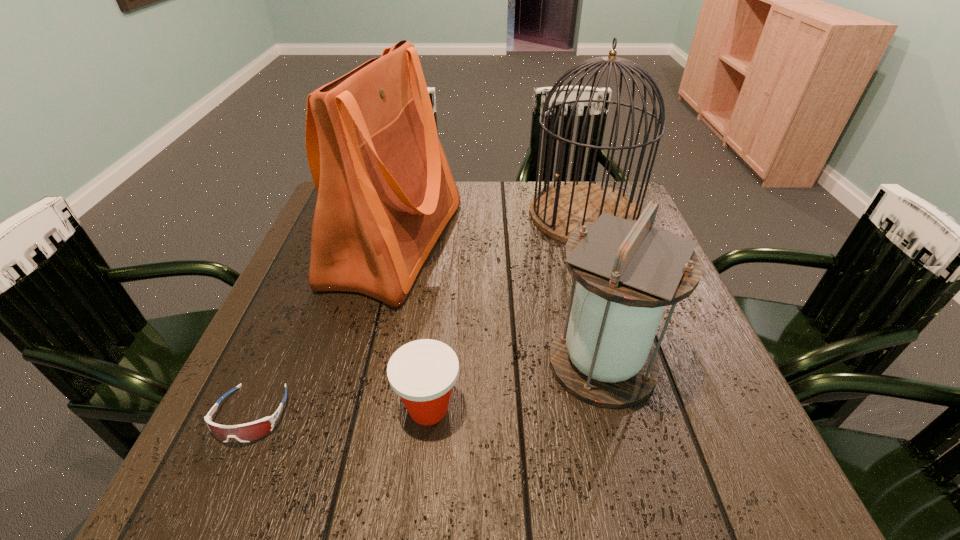
Where is `free space at the right edge of the desktop`? The height and width of the screenshot is (540, 960). free space at the right edge of the desktop is located at coordinates (680, 430).

You are a GUI agent. You are given a task and a screenshot of the screen. Output one action in this format:
    pyautogui.click(x=<x>, y=<y>)
    Task: Click on the vacant point at the near left corner
    
    Given the screenshot: What is the action you would take?
    pyautogui.click(x=257, y=489)

The width and height of the screenshot is (960, 540). What are the coordinates of `free space at the near right corner of the desktop` in the screenshot? It's located at (749, 484).

You are a GUI agent. You are given a task and a screenshot of the screen. Output one action in this format:
    pyautogui.click(x=<x>, y=<y>)
    Task: Click on the free space between the birdcage and the shopping bag
    The image size is (960, 540).
    Given the screenshot: What is the action you would take?
    pyautogui.click(x=490, y=228)

Where is `free space that is in between the shopping bag and the birdcage`? The width and height of the screenshot is (960, 540). free space that is in between the shopping bag and the birdcage is located at coordinates (490, 228).

Find the location of `free area in between the goggles and the shopping bag`. free area in between the goggles and the shopping bag is located at coordinates (324, 328).

Where is `empty space that is in between the birdcage and the goggles`? This screenshot has width=960, height=540. empty space that is in between the birdcage and the goggles is located at coordinates (418, 314).

Find the location of a particular element. This screenshot has width=960, height=540. vacant region between the third shortest object and the shopping bag is located at coordinates (499, 303).

At what (x,y) coordinates should I click in order to perform the action: click on vacant space in between the goggles and the Dixie cup. Please return your answer as a coordinate pair (x, y). The width and height of the screenshot is (960, 540). Looking at the image, I should click on (340, 411).

Locate an element on the screen. This screenshot has height=540, width=960. vacant region between the shopping bag and the birdcage is located at coordinates (490, 228).